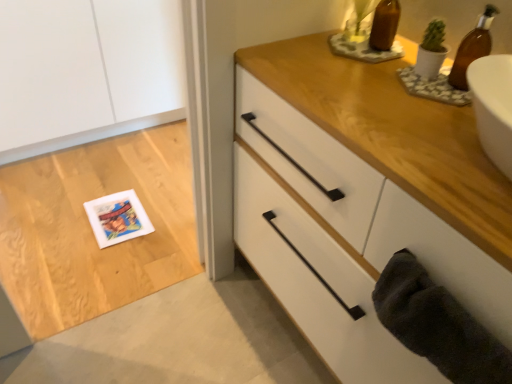
What are the coordinates of `vacant space situated on the left part of brown glass bottle at upper right` in the screenshot? It's located at (305, 54).